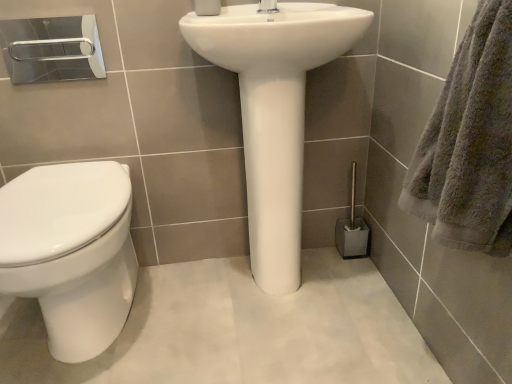
Question: From the image's perspective, relative to silver metallic towel bar at upper left, is white glossy toilet at left above or below?

Choices:
 (A) below
 (B) above

Answer: (A)

Question: From their relative heights in the image, would you say white glossy toilet at left is taller or shorter than silver metallic towel bar at upper left?

Choices:
 (A) short
 (B) tall

Answer: (B)

Question: Considering the real-world distances, which object is farthest from the gray fluffy towel at right?

Choices:
 (A) white matte toilet paper at upper center
 (B) silver metallic towel bar at upper left
 (C) white glossy toilet at left
 (D) metallic silver toilet brush at lower right
 (E) white glossy tap at upper center

Answer: (B)

Question: Estimate the real-world distances between objects in this image. Which object is closer to the gray fluffy towel at right?

Choices:
 (A) silver metallic towel bar at upper left
 (B) white glossy tap at upper center
 (C) metallic silver toilet brush at lower right
 (D) white glossy toilet at left
 (E) white matte toilet paper at upper center

Answer: (B)